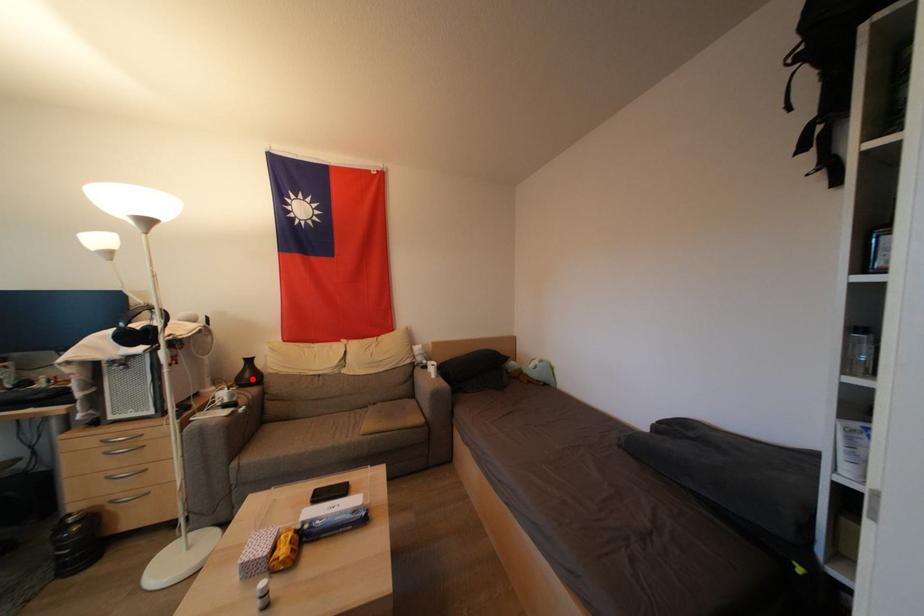
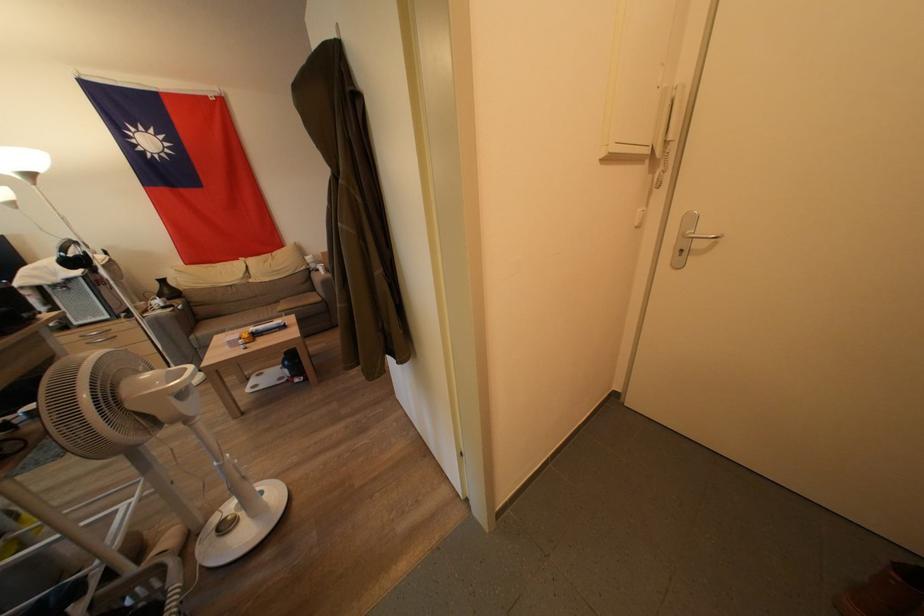
Find the pixel in the second image that matches the highlighted location in the first image.

(172, 296)